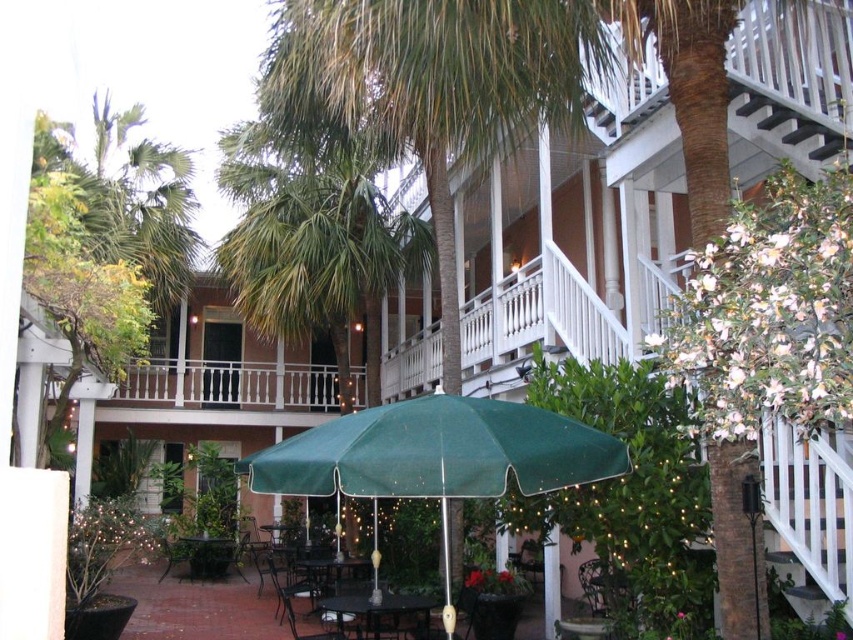
You are a guest at the resort and want to sit in the shade provided by the umbrella. You see the metallic dark green chair at center and the metallic silver chair at lower center. Which chair is closer to the center of the patio?

The metallic dark green chair at center is positioned on the right side of the metallic silver chair at lower center, so the metallic silver chair at lower center is closer to the center of the patio.